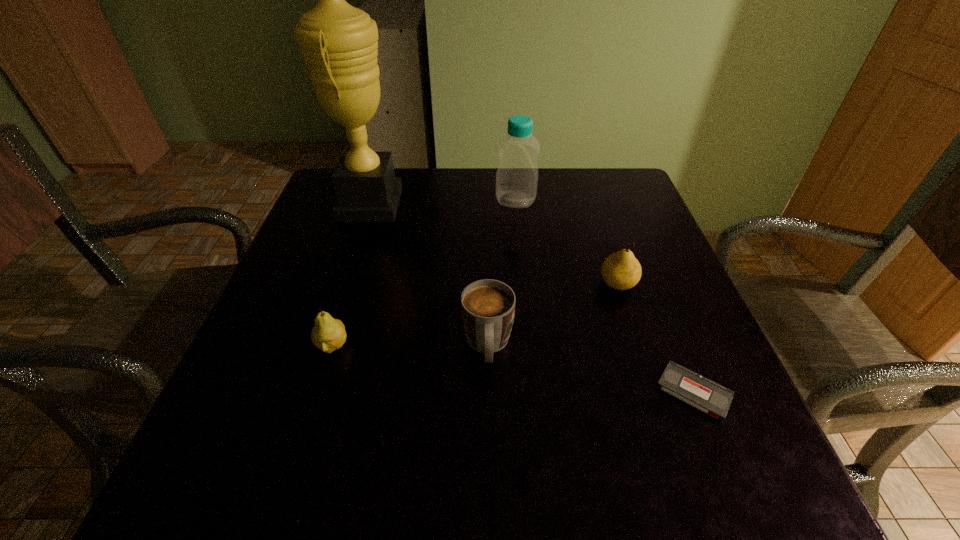
This screenshot has width=960, height=540. In order to click on trophy cup in this screenshot , I will do `click(339, 42)`.

The width and height of the screenshot is (960, 540). What are the coordinates of `bottle` in the screenshot? It's located at (517, 175).

Where is `the farther pear`? The image size is (960, 540). the farther pear is located at coordinates (621, 270).

This screenshot has width=960, height=540. I want to click on the right pear, so click(621, 270).

In order to click on mug in this screenshot , I will do `click(488, 306)`.

At what (x,y) coordinates should I click in order to perform the action: click on the nearer pear. Please return your answer as a coordinate pair (x, y). Image resolution: width=960 pixels, height=540 pixels. Looking at the image, I should click on (328, 334).

You are a GUI agent. You are given a task and a screenshot of the screen. Output one action in this format:
    pyautogui.click(x=<x>, y=<y>)
    Task: Click on the shortest object
    
    Given the screenshot: What is the action you would take?
    pyautogui.click(x=690, y=387)

This screenshot has height=540, width=960. Identify the location of free spot located at the front of the tallest object with handles. (514, 204).

This screenshot has width=960, height=540. Find the location of `vacant space located 0.060m on the left of the fifth shortest object`. vacant space located 0.060m on the left of the fifth shortest object is located at coordinates (471, 200).

Where is `vacant space located 0.210m on the back of the right pear`? Image resolution: width=960 pixels, height=540 pixels. vacant space located 0.210m on the back of the right pear is located at coordinates (594, 214).